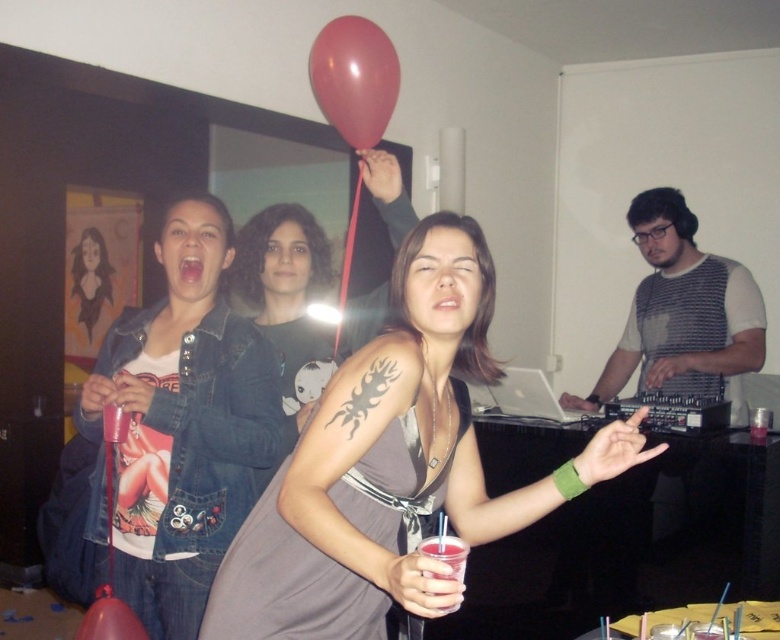
You are at the party and want to move from the point at coordinates point (378, 72) to the point at coordinates point (440, 541). Which direction should you move to reach there?

You should move forward because point (378, 72) is behind point (440, 541), so moving forward from point (378, 72) will take you towards point (440, 541).

You are organizing a photo shoot and need to ensure that the matte gray dress at center and the rubber balloon at upper center are both visible in the frame. Based on their sizes, which object should you prioritize positioning first to avoid overcrowding the composition?

The matte gray dress at center should be prioritized since it is wider than the rubber balloon at upper center, so positioning it first ensures there is enough space for both in the frame.